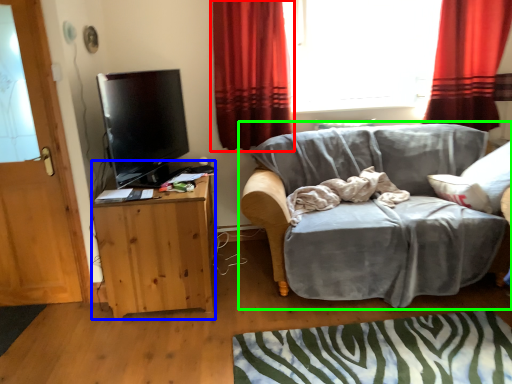
Question: Based on their relative distances, which object is farther from curtain (highlighted by a red box)? Choose from cabinetry (highlighted by a blue box) and studio couch (highlighted by a green box).

Choices:
 (A) cabinetry
 (B) studio couch

Answer: (B)